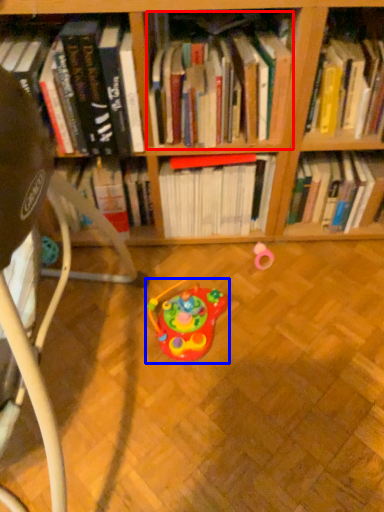
Question: Which point is further to the camera, book (highlighted by a red box) or toy (highlighted by a blue box)?

Choices:
 (A) book
 (B) toy

Answer: (B)